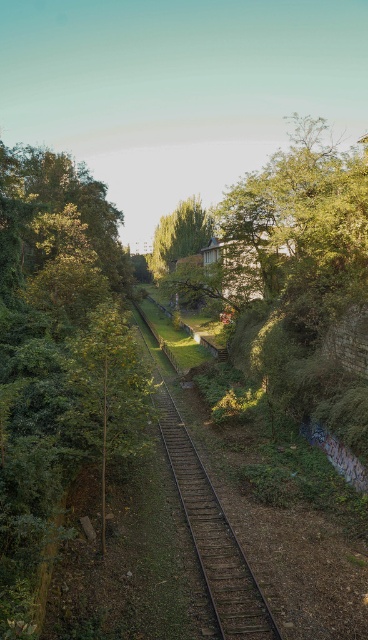
Question: Is brown wooden train track at center bigger than green leafy tree at center?

Choices:
 (A) yes
 (B) no

Answer: (B)

Question: Observing the image, what is the correct spatial positioning of brown wooden train track at center in reference to green leafy tree at center?

Choices:
 (A) below
 (B) above

Answer: (A)

Question: Considering the relative positions of brown wooden train track at center and green leafy tree at center in the image provided, where is brown wooden train track at center located with respect to green leafy tree at center?

Choices:
 (A) left
 (B) right

Answer: (B)

Question: Which object is farther from the camera taking this photo?

Choices:
 (A) green leafy tree at center
 (B) brown wooden train track at center

Answer: (A)